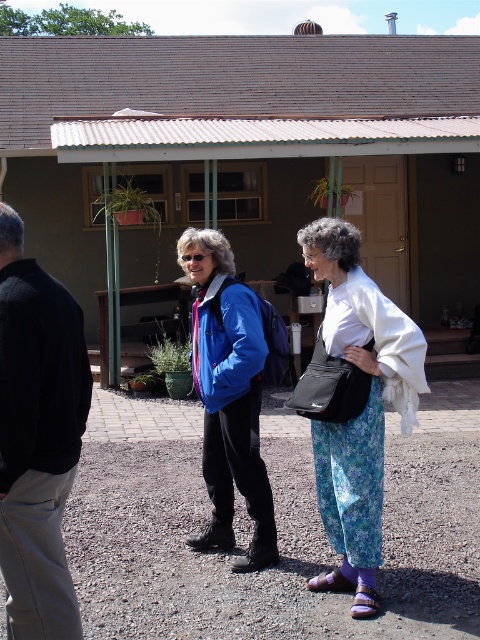
You are a photographer trying to capture a photo of the two people in front of the building. You want to ensure that both the black cotton pants at lower left and the floral fabric pants at center are clearly visible in the frame. Based on their positions, which person should be positioned closer to the left side of the photo?

The black cotton pants at lower left is to the left of floral fabric pants at center, so the person wearing the black cotton pants at lower left should be positioned closer to the left side of the photo.

You are a delivery person standing at the entrance of the building. You need to deliver a package to the person wearing black cotton pants at lower left. The delivery robot you use has a maximum range of 3 meters. Can you deliver the package using the robot?

The black cotton pants at lower left are 2.97 meters away from you, so yes, the delivery robot can deliver the package since the distance is within its 3 meters range.